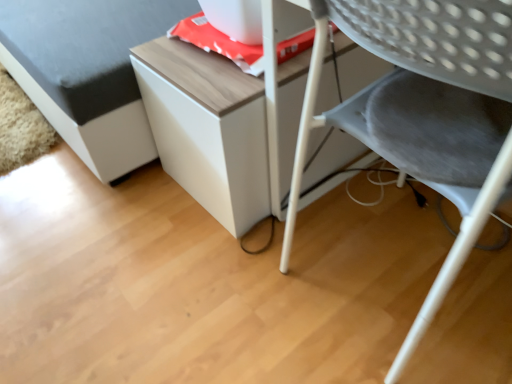
Locate an element on the screen. This screenshot has width=512, height=384. vacant space that is to the left of gray fabric chair at lower right is located at coordinates (234, 287).